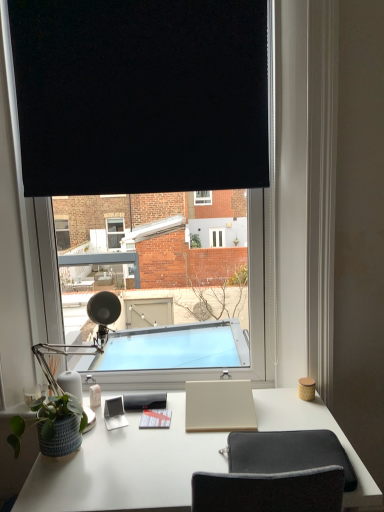
Question: In terms of height, does matte black table lamp at left look taller or shorter compared to green matte plant pot at lower left?

Choices:
 (A) short
 (B) tall

Answer: (B)

Question: Would you say matte black table lamp at left is inside or outside green matte plant pot at lower left?

Choices:
 (A) inside
 (B) outside

Answer: (B)

Question: Estimate the real-world distances between objects in this image. Which object is closer to the white matte desk at center?

Choices:
 (A) black matte window at center
 (B) black fabric at upper center
 (C) matte black table lamp at left
 (D) beige matte notepad at center, marked as the 3th notepad in a left-to-right arrangement
 (E) matte gray notepad at center, placed as the 1th notepad when sorted from left to right

Answer: (D)

Question: Estimate the real-world distances between objects in this image. Which object is closer to the beige matte notepad at center, the first notepad viewed from the right?

Choices:
 (A) matte gray notepad at center, placed as the 1th notepad when sorted from left to right
 (B) matte black table lamp at left
 (C) dark gray fabric computer chair at lower center
 (D) black matte window at center
 (E) black fabric at upper center

Answer: (C)